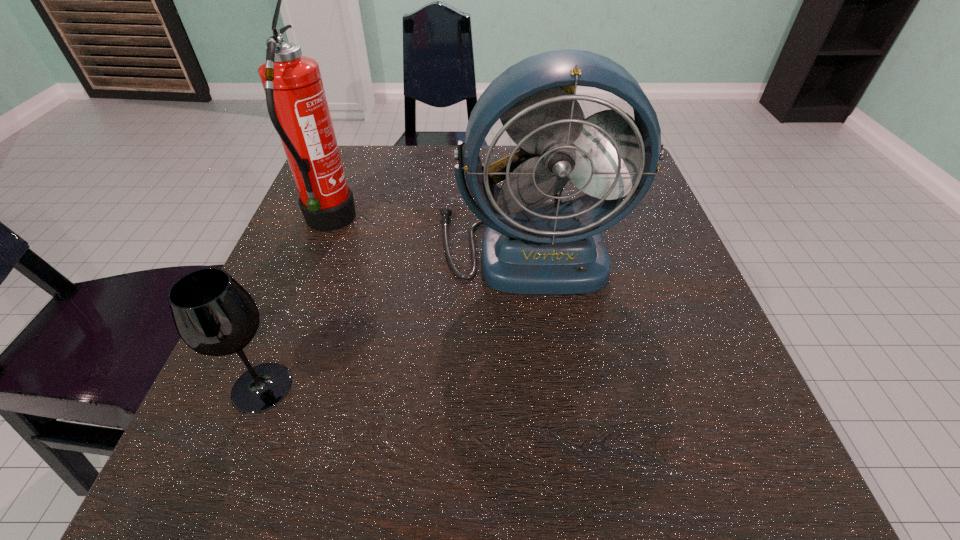
This screenshot has height=540, width=960. Find the location of `unoccupied area between the rightmost object and the nearest object`. unoccupied area between the rightmost object and the nearest object is located at coordinates (396, 317).

At what (x,y) coordinates should I click in order to perform the action: click on free point between the nearest object and the fan. Please return your answer as a coordinate pair (x, y). Image resolution: width=960 pixels, height=540 pixels. Looking at the image, I should click on (396, 317).

What are the coordinates of `vacant area that lies between the shortest object and the fan` in the screenshot? It's located at (396, 317).

The width and height of the screenshot is (960, 540). Find the location of `blank region between the rightmost object and the fire extinguisher`. blank region between the rightmost object and the fire extinguisher is located at coordinates (429, 234).

Where is `vacant space that's between the shortest object and the fire extinguisher`? vacant space that's between the shortest object and the fire extinguisher is located at coordinates (296, 305).

The image size is (960, 540). I want to click on vacant space that's between the fan and the fire extinguisher, so click(429, 234).

Locate an element on the screen. The width and height of the screenshot is (960, 540). vacant area between the fire extinguisher and the fan is located at coordinates (429, 234).

The width and height of the screenshot is (960, 540). I want to click on free point between the fan and the shortest object, so click(396, 317).

Locate which object is the closest to the rightmost object. Please provide its 2D coordinates. Your answer should be formatted as a tuple, i.e. [(x, y)], where the tuple contains the x and y coordinates of a point satisfying the conditions above.

[(297, 105)]

Select which object is the closest to the rightmost object. Please provide its 2D coordinates. Your answer should be formatted as a tuple, i.e. [(x, y)], where the tuple contains the x and y coordinates of a point satisfying the conditions above.

[(297, 105)]